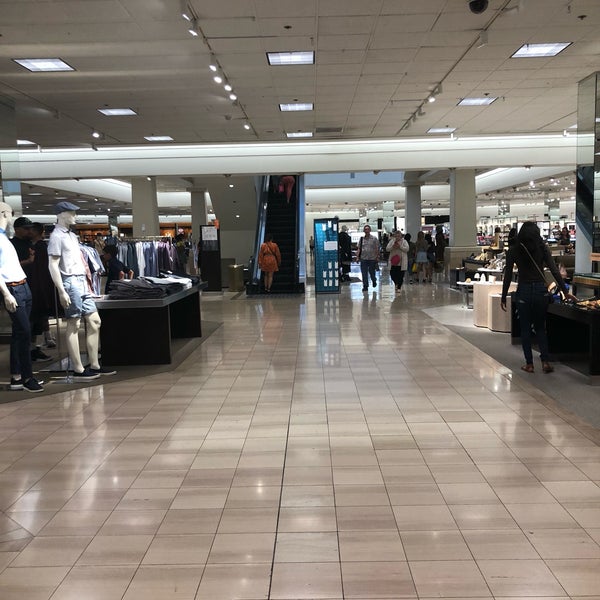
Identify the location of rectangle lights. The height and width of the screenshot is (600, 600). (298, 135), (435, 130), (149, 136), (19, 142).